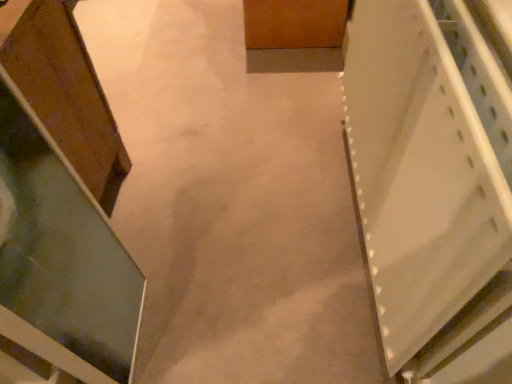
Question: Can you confirm if white plastic shelf at right, which ranks as the second cabinetry in left-to-right order, is thinner than wooden cabinet at left, which is the 2th cabinetry in right-to-left order?

Choices:
 (A) no
 (B) yes

Answer: (B)

Question: From the image's perspective, is white plastic shelf at right, which ranks as the second cabinetry in left-to-right order, on wooden cabinet at left, the first cabinetry positioned from the left?

Choices:
 (A) yes
 (B) no

Answer: (B)

Question: Is white plastic shelf at right, the first cabinetry in the right-to-left sequence, positioned behind wooden cabinet at left, the first cabinetry positioned from the left?

Choices:
 (A) yes
 (B) no

Answer: (B)

Question: Could you tell me if white plastic shelf at right, which ranks as the second cabinetry in left-to-right order, is turned towards wooden cabinet at left, which is the 2th cabinetry in right-to-left order?

Choices:
 (A) no
 (B) yes

Answer: (B)

Question: Does white plastic shelf at right, the first cabinetry in the right-to-left sequence, appear on the right side of wooden cabinet at left, the first cabinetry positioned from the left?

Choices:
 (A) yes
 (B) no

Answer: (A)

Question: Does white plastic shelf at right, which ranks as the second cabinetry in left-to-right order, have a greater height compared to wooden cabinet at left, the first cabinetry positioned from the left?

Choices:
 (A) yes
 (B) no

Answer: (B)

Question: Are wooden cabinet at left, which is the 2th cabinetry in right-to-left order, and white plastic shelf at right, the first cabinetry in the right-to-left sequence, far apart?

Choices:
 (A) no
 (B) yes

Answer: (A)

Question: Is wooden cabinet at left, the first cabinetry positioned from the left, further to the viewer compared to white plastic shelf at right, the first cabinetry in the right-to-left sequence?

Choices:
 (A) yes
 (B) no

Answer: (A)

Question: Is wooden cabinet at left, the first cabinetry positioned from the left, positioned in front of white plastic shelf at right, the first cabinetry in the right-to-left sequence?

Choices:
 (A) yes
 (B) no

Answer: (B)

Question: Is wooden cabinet at left, the first cabinetry positioned from the left, placed right next to white plastic shelf at right, the first cabinetry in the right-to-left sequence?

Choices:
 (A) yes
 (B) no

Answer: (B)

Question: Does wooden cabinet at left, the first cabinetry positioned from the left, have a greater height compared to white plastic shelf at right, the first cabinetry in the right-to-left sequence?

Choices:
 (A) no
 (B) yes

Answer: (B)

Question: Considering the relative sizes of wooden cabinet at left, the first cabinetry positioned from the left, and white plastic shelf at right, which ranks as the second cabinetry in left-to-right order, in the image provided, is wooden cabinet at left, the first cabinetry positioned from the left, smaller than white plastic shelf at right, which ranks as the second cabinetry in left-to-right order,?

Choices:
 (A) no
 (B) yes

Answer: (A)

Question: Considering the positions of white plastic shelf at right, the first cabinetry in the right-to-left sequence, and wooden cabinet at left, which is the 2th cabinetry in right-to-left order, in the image, is white plastic shelf at right, the first cabinetry in the right-to-left sequence, wider or thinner than wooden cabinet at left, which is the 2th cabinetry in right-to-left order,?

Choices:
 (A) wide
 (B) thin

Answer: (B)